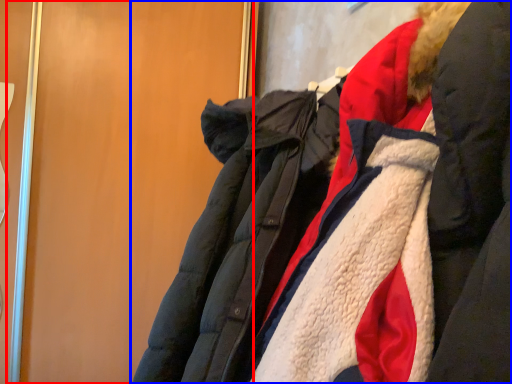
Question: Which point is closer to the camera, door (highlighted by a red box) or jacket (highlighted by a blue box)?

Choices:
 (A) door
 (B) jacket

Answer: (B)